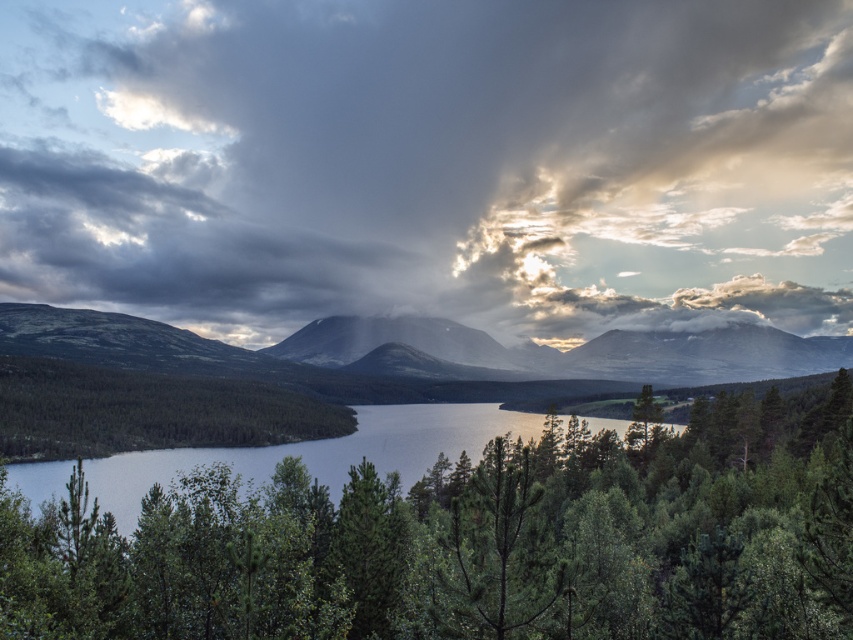
Based on the scene description, where is the cloudy sky at center located in terms of coordinates?

The cloudy sky at center is located at coordinates point (x=430, y=163).

Looking at this image, you are standing in the middle of the landscape and looking straight ahead. Which of the two objects, the cloudy sky at center or the smooth gray mountain at center, appears taller from your perspective?

The cloudy sky at center appears taller than the smooth gray mountain at center from your perspective.